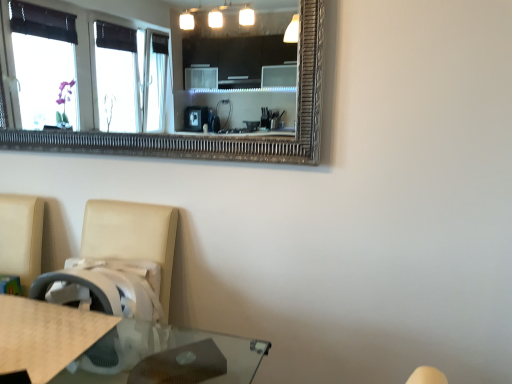
Question: In the image, is beige leather swivel chair at lower left positioned in front of or behind beige textured mat at lower left?

Choices:
 (A) front
 (B) behind

Answer: (B)

Question: Considering the positions of point (156, 319) and point (23, 352), is point (156, 319) closer or farther from the camera than point (23, 352)?

Choices:
 (A) farther
 (B) closer

Answer: (A)

Question: Is beige leather swivel chair at lower left to the left or to the right of beige textured mat at lower left in the image?

Choices:
 (A) right
 (B) left

Answer: (A)

Question: Is beige textured mat at lower left to the left or to the right of beige leather swivel chair at lower left in the image?

Choices:
 (A) right
 (B) left

Answer: (B)

Question: Is point (57, 342) positioned closer to the camera than point (103, 301)?

Choices:
 (A) closer
 (B) farther

Answer: (A)

Question: Looking at the image, does beige textured mat at lower left seem bigger or smaller compared to beige leather swivel chair at lower left?

Choices:
 (A) big
 (B) small

Answer: (B)

Question: Is beige textured mat at lower left wider or thinner than beige leather swivel chair at lower left?

Choices:
 (A) wide
 (B) thin

Answer: (B)